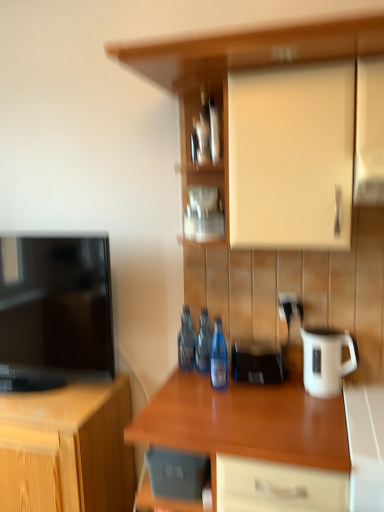
Where is `black glossy television at left`? Image resolution: width=384 pixels, height=512 pixels. black glossy television at left is located at coordinates (55, 310).

What do you see at coordinates (249, 51) in the screenshot?
I see `matte wood cabinet at upper center, positioned as the 1th cabinetry in right-to-left order` at bounding box center [249, 51].

Find the location of a particular element. The width and height of the screenshot is (384, 512). wooden cabinet at left, which is counted as the 1th cabinetry, starting from the left is located at coordinates (67, 449).

From the image's perspective, relative to white plastic electric outlet at center-right, is transparent glass bottle at center, the second bottle viewed from the back, above or below?

transparent glass bottle at center, the second bottle viewed from the back, is situated lower than white plastic electric outlet at center-right in the image.

Which object is positioned more to the right, transparent glass bottle at center, the second bottle viewed from the back, or white plastic electric outlet at center-right?

Positioned to the right is white plastic electric outlet at center-right.

Who is shorter, transparent glass bottle at center, which appears as the second bottle when viewed from the front, or white plastic electric outlet at center-right?

white plastic electric outlet at center-right is shorter.

In the scene shown: Is transparent glass bottle at center, the second bottle viewed from the back, surrounding white plastic electric outlet at center-right?

No, transparent glass bottle at center, the second bottle viewed from the back, does not contain white plastic electric outlet at center-right.

Which object is positioned more to the left, blue glass bottle at center, which ranks as the 1th bottle in front-to-back order, or wooden shelves at center, placed as the second shelf when sorted from back to front?

From the viewer's perspective, wooden shelves at center, placed as the second shelf when sorted from back to front, appears more on the left side.

From the image's perspective, between blue glass bottle at center, which ranks as the 1th bottle in front-to-back order, and wooden shelves at center, which appears as the first shelf when viewed from the front, which one is located above?

wooden shelves at center, which appears as the first shelf when viewed from the front, from the image's perspective.

Can you see blue glass bottle at center, which ranks as the 1th bottle in front-to-back order, touching wooden shelves at center, placed as the second shelf when sorted from back to front?

No, blue glass bottle at center, which ranks as the 1th bottle in front-to-back order, is not in contact with wooden shelves at center, placed as the second shelf when sorted from back to front.

From the image's perspective, which one is positioned higher, black glossy television at left or wooden shelves at center, placed as the second shelf when sorted from back to front?

wooden shelves at center, placed as the second shelf when sorted from back to front, appears higher in the image.

Looking at this image, which point is more forward, (99,279) or (199,90)?

The point (199,90) is more forward.

At what (x,y) coordinates should I click in order to perform the action: click on television below the wooden shelves at center, placed as the second shelf when sorted from back to front (from a real-world perspective). Please return your answer as a coordinate pair (x, y). Looking at the image, I should click on pos(55,310).

Is black glossy television at left facing away from wooden shelves at center, which appears as the first shelf when viewed from the front?

No, wooden shelves at center, which appears as the first shelf when viewed from the front, is not at the back of black glossy television at left.

Can you confirm if white glossy counter at lower right is thinner than white plastic electric outlet at center-right?

No, white glossy counter at lower right is not thinner than white plastic electric outlet at center-right.

From the picture: Is white glossy counter at lower right positioned with its back to white plastic electric outlet at center-right?

white glossy counter at lower right is not turned away from white plastic electric outlet at center-right.

How many degrees apart are the facing directions of white glossy counter at lower right and white plastic electric outlet at center-right?

The facing directions of white glossy counter at lower right and white plastic electric outlet at center-right are 0.215 degrees apart.

Which of these two, white glossy counter at lower right or white plastic electric outlet at center-right, stands taller?

Standing taller between the two is white glossy counter at lower right.

Is white glossy jug at right far away from metallic silver frame at center, the second shelf when ordered from front to back?

No, white glossy jug at right is in close proximity to metallic silver frame at center, the second shelf when ordered from front to back.

Based on the photo, is white glossy jug at right to the right of metallic silver frame at center, the second shelf when ordered from front to back, from the viewer's perspective?

Yes, white glossy jug at right is to the right of metallic silver frame at center, the second shelf when ordered from front to back.

Is metallic silver frame at center, the 1th shelf in the back-to-front sequence, located within white glossy jug at right?

That's incorrect, metallic silver frame at center, the 1th shelf in the back-to-front sequence, is not inside white glossy jug at right.

Looking at this image, which of these two, white glossy jug at right or metallic silver frame at center, the second shelf when ordered from front to back, stands shorter?

metallic silver frame at center, the second shelf when ordered from front to back.

Looking at this image, considering the sizes of objects matte wood cabinet at upper center, the 2th cabinetry positioned from the bottom, and glossy wood countertop at center in the image provided, who is taller, matte wood cabinet at upper center, the 2th cabinetry positioned from the bottom, or glossy wood countertop at center?

glossy wood countertop at center is taller.

Is matte wood cabinet at upper center, the 1th cabinetry from the top, to the right of glossy wood countertop at center from the viewer's perspective?

Indeed, matte wood cabinet at upper center, the 1th cabinetry from the top, is positioned on the right side of glossy wood countertop at center.

Image resolution: width=384 pixels, height=512 pixels. What are the coordinates of `countertop to the left of matte wood cabinet at upper center, the 2th cabinetry positioned from the bottom` in the screenshot? It's located at (245, 423).

Is white plastic electric outlet at center-right next to transparent glass bottle at center, which appears as the second bottle when viewed from the front, and touching it?

No, white plastic electric outlet at center-right is not making contact with transparent glass bottle at center, which appears as the second bottle when viewed from the front.

Is white plastic electric outlet at center-right located outside transparent glass bottle at center, which appears as the second bottle when viewed from the front?

Yes, white plastic electric outlet at center-right is located beyond the bounds of transparent glass bottle at center, which appears as the second bottle when viewed from the front.

From a real-world perspective, between white plastic electric outlet at center-right and transparent glass bottle at center, the second bottle viewed from the back, who is vertically higher?

white plastic electric outlet at center-right, from a real-world perspective.

Can you confirm if white plastic electric outlet at center-right is bigger than transparent glass bottle at center, the second bottle viewed from the back?

No.

In order to click on electric outlet above the transparent glass bottle at center, the second bottle viewed from the back (from the image's perspective) in this screenshot , I will do `click(287, 302)`.

From a real-world perspective, which shelf is the 2nd one above the blue glass bottle at center, which ranks as the 1th bottle in front-to-back order? Please provide its 2D coordinates.

[(192, 127)]

Estimate the real-world distances between objects in this image. Which object is further from matte wood cabinet at upper center, the 2th cabinetry positioned from the bottom, white plastic electric outlet at center-right or glossy wood countertop at center?

Based on the image, white plastic electric outlet at center-right appears to be further to matte wood cabinet at upper center, the 2th cabinetry positioned from the bottom.

Looking at the image, which one is located further to blue glass bottle at center, the third bottle in the back-to-front sequence, white plastic electric outlet at center-right or glossy wood countertop at center?

white plastic electric outlet at center-right lies further to blue glass bottle at center, the third bottle in the back-to-front sequence, than the other object.

Estimate the real-world distances between objects in this image. Which object is further from transparent glass bottle at center, the second bottle viewed from the back, wooden cabinet at left, which appears as the first cabinetry when ordered from the bottom, or matte wood cabinet at upper center, the 1th cabinetry from the top?

The object further to transparent glass bottle at center, the second bottle viewed from the back, is matte wood cabinet at upper center, the 1th cabinetry from the top.

Which object lies further to the anchor point transparent glass bottle at center, which appears as the second bottle when viewed from the front, white glossy counter at lower right or black plastic phone at center?

The object further to transparent glass bottle at center, which appears as the second bottle when viewed from the front, is white glossy counter at lower right.

Considering their positions, is matte wood cabinet at upper center, the 1th cabinetry from the top, positioned closer to white plastic electric outlet at center-right than blue glass bottle at center, which ranks as the 1th bottle in front-to-back order?

blue glass bottle at center, which ranks as the 1th bottle in front-to-back order, is closer to white plastic electric outlet at center-right.

Estimate the real-world distances between objects in this image. Which object is closer to glossy wood countertop at center, metallic silver frame at center, the second shelf when ordered from front to back, or blue glass bottle at center, the third bottle in the back-to-front sequence?

blue glass bottle at center, the third bottle in the back-to-front sequence, lies closer to glossy wood countertop at center than the other object.

Estimate the real-world distances between objects in this image. Which object is further from blue glass bottle at center, the third bottle in the back-to-front sequence, wooden cabinet at left, which appears as the second cabinetry when viewed from the top, or transparent glass bottle at center, the second bottle viewed from the back?

Among the two, wooden cabinet at left, which appears as the second cabinetry when viewed from the top, is located further to blue glass bottle at center, the third bottle in the back-to-front sequence.

Which object lies nearer to the anchor point blue glass bottle at center, the third bottle in the back-to-front sequence, black glossy television at left or white glossy jug at right?

Based on the image, white glossy jug at right appears to be nearer to blue glass bottle at center, the third bottle in the back-to-front sequence.

Where is `bottle situated between black glossy television at left and metallic silver frame at center, the second shelf when ordered from front to back, from left to right`? The image size is (384, 512). bottle situated between black glossy television at left and metallic silver frame at center, the second shelf when ordered from front to back, from left to right is located at coordinates (186, 341).

Locate an element on the screen. bottle between wooden shelves at center, placed as the second shelf when sorted from back to front, and transparent glass bottle at center, which appears as the second bottle when viewed from the front, in the up-down direction is located at coordinates (186, 341).

Locate an element on the screen. appliance between black glossy television at left and white glossy jug at right is located at coordinates (256, 362).

Where is `television between matte wood cabinet at upper center, which ranks as the second cabinetry in left-to-right order, and glossy wood countertop at center, in the vertical direction`? This screenshot has height=512, width=384. television between matte wood cabinet at upper center, which ranks as the second cabinetry in left-to-right order, and glossy wood countertop at center, in the vertical direction is located at coordinates (55, 310).